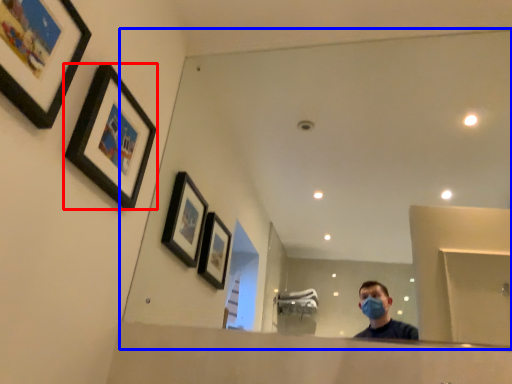
Question: Which point is closer to the camera, picture frame (highlighted by a red box) or mirror (highlighted by a blue box)?

Choices:
 (A) picture frame
 (B) mirror

Answer: (B)